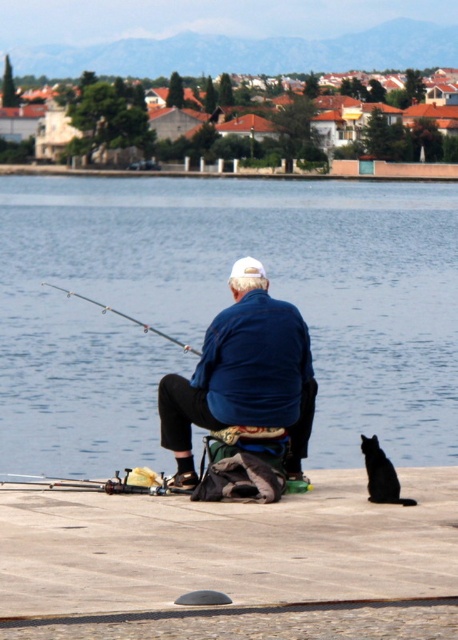
Can you confirm if blue water at center is positioned to the left of blue cotton jacket at center?

Yes, blue water at center is to the left of blue cotton jacket at center.

Is blue water at center below blue cotton jacket at center?

No, blue water at center is not below blue cotton jacket at center.

Who is more forward, (447, 288) or (289, 408)?

Positioned in front is point (289, 408).

I want to click on blue water at center, so click(223, 307).

Between black fur cat at lower right and silver metallic fishing pole at left, which one is positioned lower?

black fur cat at lower right is below.

Can you confirm if black fur cat at lower right is shorter than silver metallic fishing pole at left?

Yes, black fur cat at lower right is shorter than silver metallic fishing pole at left.

The height and width of the screenshot is (640, 458). What are the coordinates of `black fur cat at lower right` in the screenshot? It's located at (381, 474).

Which is more to the right, blue water at center or brushed metal fishing pole at lower left?

brushed metal fishing pole at lower left

What do you see at coordinates (223, 307) in the screenshot?
I see `blue water at center` at bounding box center [223, 307].

Is point (114, 452) positioned in front of point (123, 484)?

No.

This screenshot has width=458, height=640. I want to click on blue water at center, so click(223, 307).